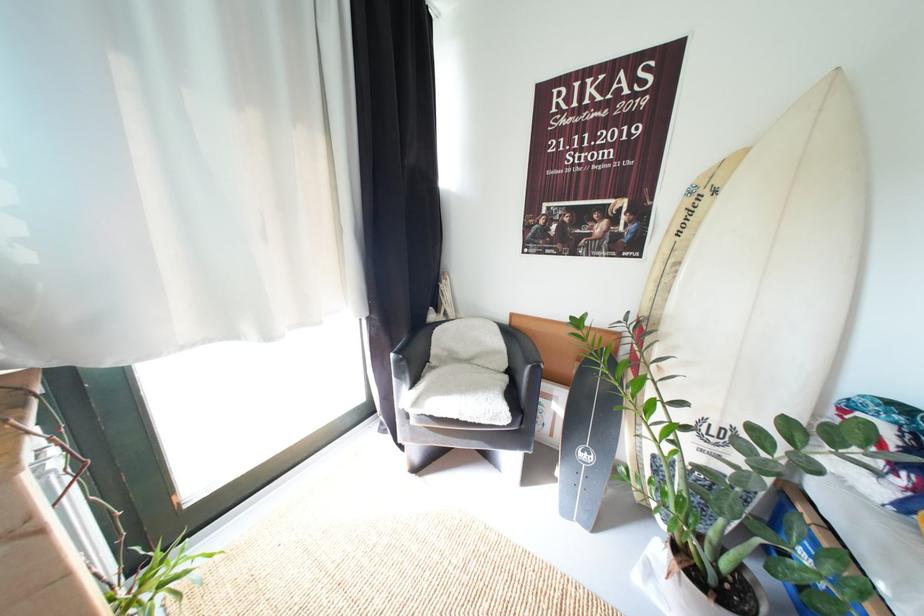
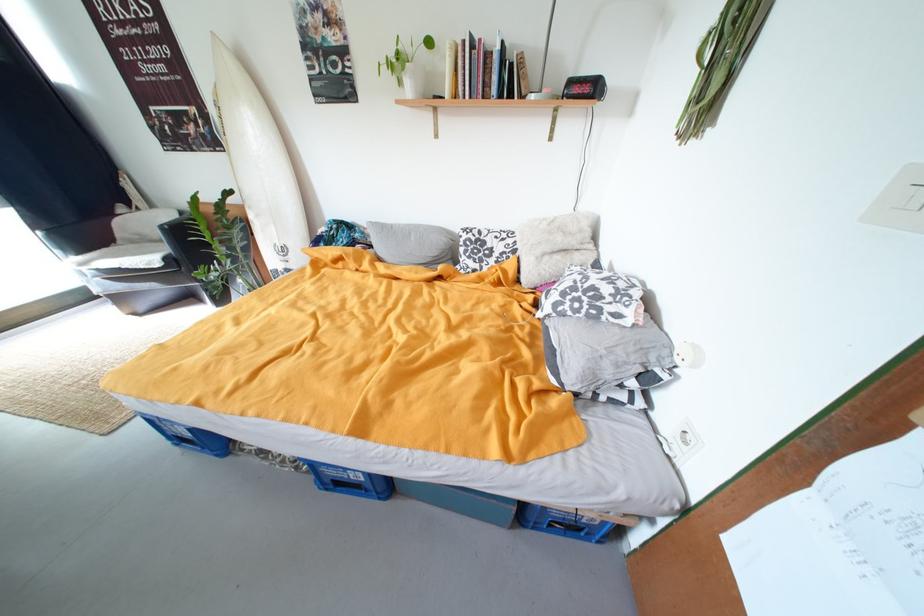
Locate, in the second image, the point that corresponds to the point at 709,196 in the first image.

(225, 108)